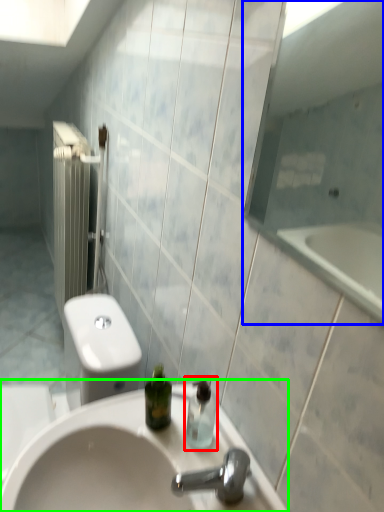
Question: Which is nearer to the soap dispenser (highlighted by a red box)? mirror (highlighted by a blue box) or sink (highlighted by a green box).

Choices:
 (A) mirror
 (B) sink

Answer: (B)